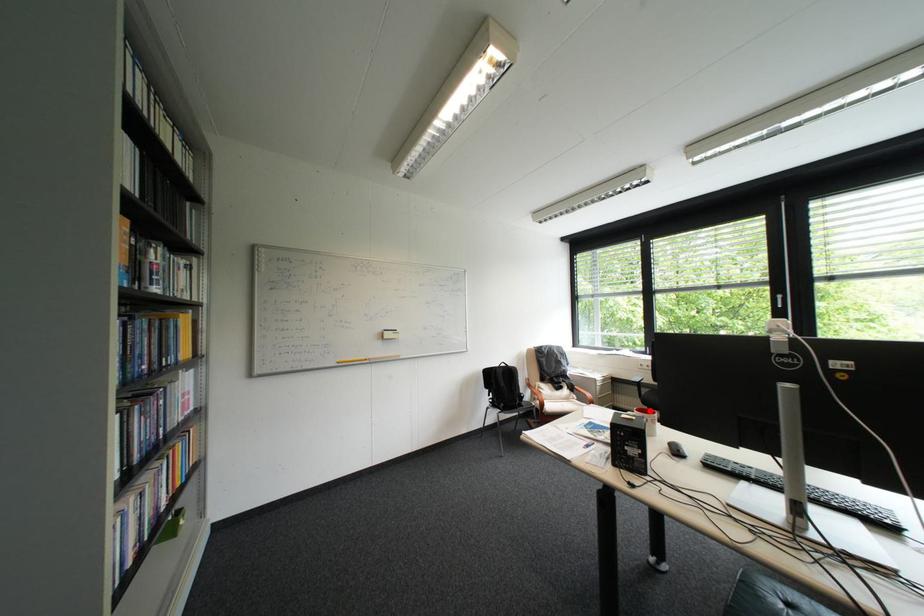
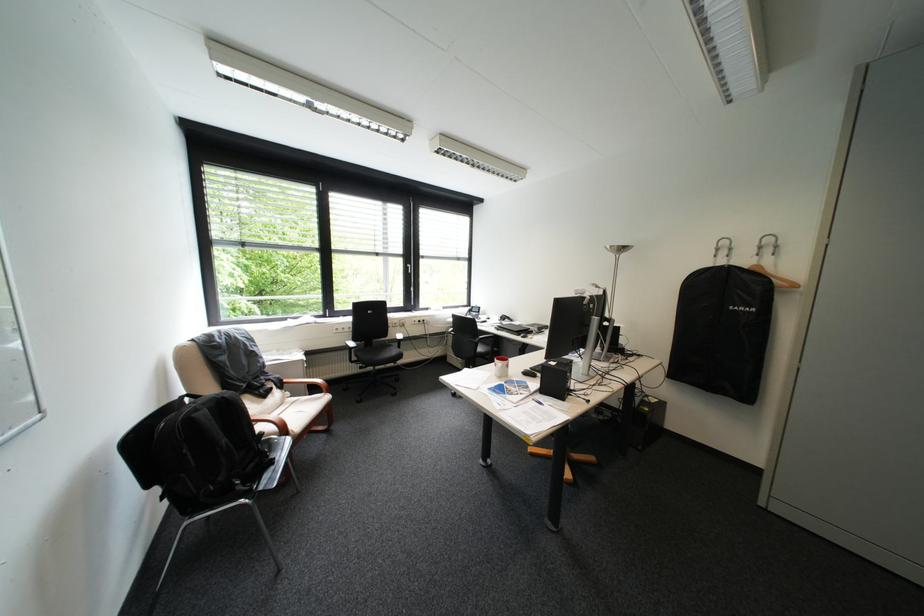
Question: I am providing you with two images of the same scene from different viewpoints. A red point is marked on the first image. Can you still see the location of the red point in image 2?

Choices:
 (A) Yes
 (B) No

Answer: (B)